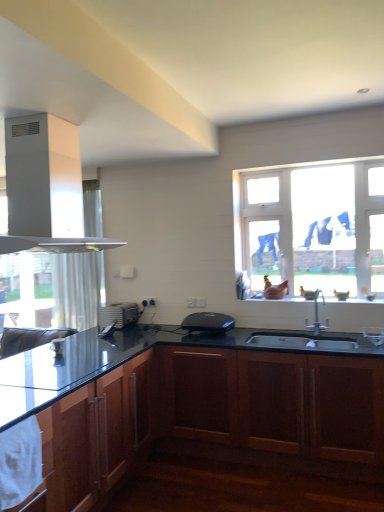
Question: From the image's perspective, is satin silver toaster at lower center, marked as the 1th appliance in a left-to-right arrangement, beneath glossy wood cabinet at lower left, the first cabinetry viewed from the left?

Choices:
 (A) no
 (B) yes

Answer: (A)

Question: Does satin silver toaster at lower center, which appears as the 2th appliance when viewed from the front, come in front of glossy wood cabinet at lower left, acting as the 2th cabinetry starting from the right?

Choices:
 (A) yes
 (B) no

Answer: (B)

Question: Is satin silver toaster at lower center, marked as the 1th appliance in a left-to-right arrangement, smaller than glossy wood cabinet at lower left, the first cabinetry viewed from the left?

Choices:
 (A) yes
 (B) no

Answer: (A)

Question: Is satin silver toaster at lower center, which is the second appliance from right to left, outside of glossy wood cabinet at lower left, acting as the 2th cabinetry starting from the right?

Choices:
 (A) no
 (B) yes

Answer: (B)

Question: From a real-world perspective, is satin silver toaster at lower center, which appears as the 2th appliance when viewed from the front, under glossy wood cabinet at lower left, acting as the 2th cabinetry starting from the right?

Choices:
 (A) yes
 (B) no

Answer: (B)

Question: From a real-world perspective, is black plastic toaster at center, positioned as the first appliance in right-to-left order, physically located above or below satin silver toaster at lower center, marked as the 1th appliance in a left-to-right arrangement?

Choices:
 (A) below
 (B) above

Answer: (A)

Question: In terms of width, does black plastic toaster at center, the 2th appliance in the back-to-front sequence, look wider or thinner when compared to satin silver toaster at lower center, which appears as the 2th appliance when viewed from the front?

Choices:
 (A) thin
 (B) wide

Answer: (B)

Question: Considering the positions of black plastic toaster at center, the first appliance in the front-to-back sequence, and satin silver toaster at lower center, positioned as the 1th appliance in back-to-front order, in the image, is black plastic toaster at center, the first appliance in the front-to-back sequence, bigger or smaller than satin silver toaster at lower center, positioned as the 1th appliance in back-to-front order,?

Choices:
 (A) big
 (B) small

Answer: (A)

Question: From the image's perspective, is black plastic toaster at center, the 2th appliance in the back-to-front sequence, above or below satin silver toaster at lower center, which is the second appliance from right to left?

Choices:
 (A) below
 (B) above

Answer: (A)

Question: Is point (163, 415) positioned closer to the camera than point (9, 131)?

Choices:
 (A) closer
 (B) farther

Answer: (B)

Question: Looking at the image, does dark wood cabinet at lower center, acting as the 2th cabinetry starting from the left, seem bigger or smaller compared to white matte gas stove at upper left?

Choices:
 (A) big
 (B) small

Answer: (A)

Question: Considering the positions of dark wood cabinet at lower center, the 1th cabinetry in the right-to-left sequence, and white matte gas stove at upper left in the image, is dark wood cabinet at lower center, the 1th cabinetry in the right-to-left sequence, wider or thinner than white matte gas stove at upper left?

Choices:
 (A) thin
 (B) wide

Answer: (B)

Question: Based on their positions, is dark wood cabinet at lower center, the 1th cabinetry in the right-to-left sequence, located to the left or right of white matte gas stove at upper left?

Choices:
 (A) right
 (B) left

Answer: (A)

Question: Relative to matte glass window sill at center, is white matte gas stove at upper left in front or behind?

Choices:
 (A) behind
 (B) front

Answer: (B)

Question: Is point (46, 202) positioned closer to the camera than point (274, 301)?

Choices:
 (A) closer
 (B) farther

Answer: (A)